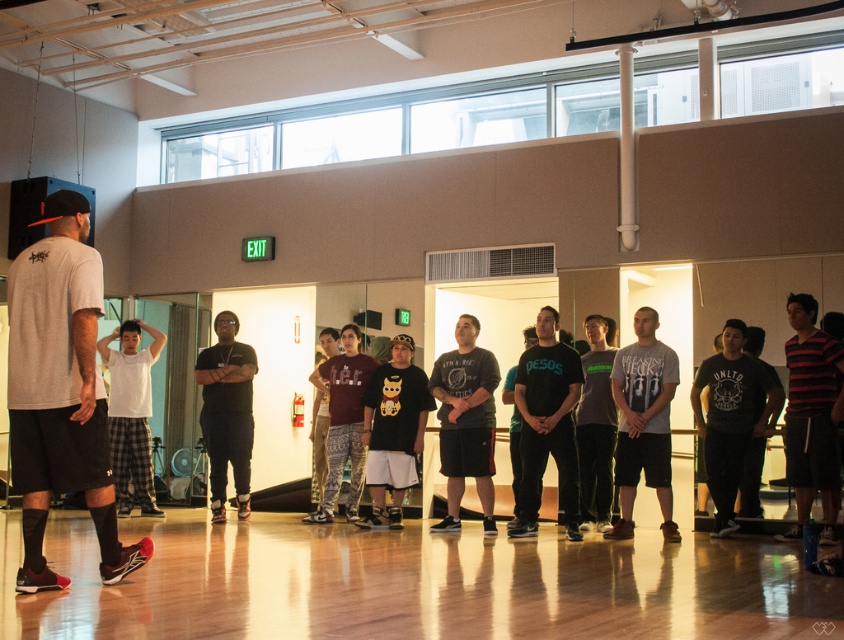
Does black matte t-shirt at center appear on the left side of matte black t-shirt at center?

Incorrect, black matte t-shirt at center is not on the left side of matte black t-shirt at center.

Identify the location of black matte t-shirt at center. (547, 422).

Is point (475, 435) behind point (249, 365)?

No, it is not.

Who is more forward, (479, 497) or (214, 464)?

Point (479, 497)

Where is `matte gray shirt at center`? This screenshot has width=844, height=640. matte gray shirt at center is located at coordinates (464, 420).

At what (x,y) coordinates should I click in order to perform the action: click on matte gray shirt at center. Please return your answer as a coordinate pair (x, y). The width and height of the screenshot is (844, 640). Looking at the image, I should click on (464, 420).

The height and width of the screenshot is (640, 844). Describe the element at coordinates (547, 422) in the screenshot. I see `black matte t-shirt at center` at that location.

Is black matte t-shirt at center above matte gray shirt at center?

Yes, black matte t-shirt at center is above matte gray shirt at center.

Is point (571, 496) behind point (468, 408)?

That is False.

Locate an element on the screen. This screenshot has width=844, height=640. black matte t-shirt at center is located at coordinates (547, 422).